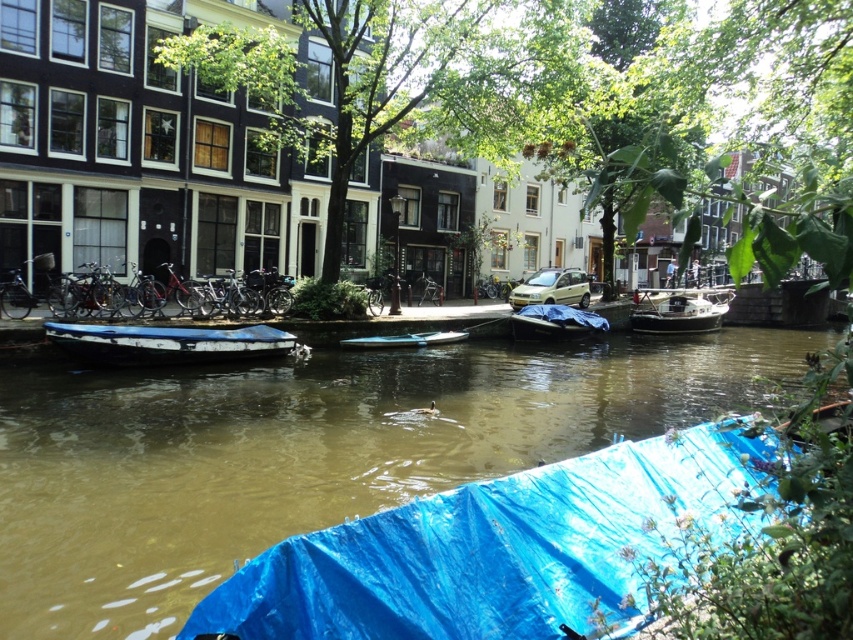
Question: Which point is closer to the camera?

Choices:
 (A) (166, 461)
 (B) (380, 337)

Answer: (A)

Question: Does blue tarpaulin boat at center appear over blue tarp-covered boat at center?

Choices:
 (A) yes
 (B) no

Answer: (B)

Question: Which of these objects is positioned farthest from the shiny silver boat at center?

Choices:
 (A) blue tarpaulin boat at center
 (B) white plastic boat at center
 (C) blue tarp-covered boat at center

Answer: (A)

Question: Which point is farther to the camera?

Choices:
 (A) (517, 323)
 (B) (12, 422)

Answer: (A)

Question: In this image, where is blue tarpaulin boat at center located relative to white plastic boat at center?

Choices:
 (A) above
 (B) below

Answer: (B)

Question: Where is blue tarpaulin boat at center located in relation to white plastic boat at center in the image?

Choices:
 (A) above
 (B) below

Answer: (B)